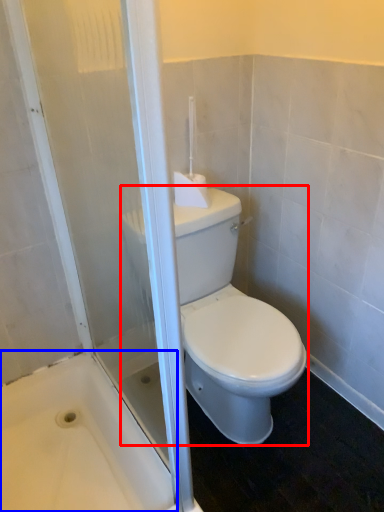
Question: Among these objects, which one is nearest to the camera, porcelain (highlighted by a red box) or bath (highlighted by a blue box)?

Choices:
 (A) porcelain
 (B) bath

Answer: (B)